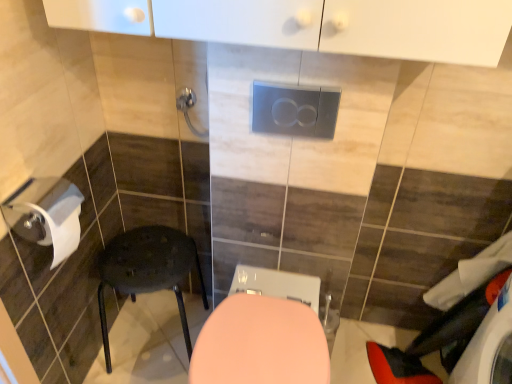
Question: Is matte black stool at lower left surrounded by metallic silver towel bar at upper center?

Choices:
 (A) yes
 (B) no

Answer: (B)

Question: From the image's perspective, is metallic silver towel bar at upper center beneath matte black stool at lower left?

Choices:
 (A) no
 (B) yes

Answer: (A)

Question: Considering the relative sizes of metallic silver towel bar at upper center and matte black stool at lower left in the image provided, is metallic silver towel bar at upper center shorter than matte black stool at lower left?

Choices:
 (A) no
 (B) yes

Answer: (B)

Question: Does metallic silver towel bar at upper center turn towards matte black stool at lower left?

Choices:
 (A) yes
 (B) no

Answer: (B)

Question: Can you confirm if metallic silver towel bar at upper center is positioned to the right of matte black stool at lower left?

Choices:
 (A) no
 (B) yes

Answer: (B)

Question: From the image's perspective, is pink glossy toilet at center above or below white fabric laundry at lower right?

Choices:
 (A) above
 (B) below

Answer: (B)

Question: Based on their sizes in the image, would you say pink glossy toilet at center is bigger or smaller than white fabric laundry at lower right?

Choices:
 (A) big
 (B) small

Answer: (A)

Question: Is pink glossy toilet at center inside or outside of white fabric laundry at lower right?

Choices:
 (A) inside
 (B) outside

Answer: (B)

Question: Is point (210, 370) closer or farther from the camera than point (509, 251)?

Choices:
 (A) farther
 (B) closer

Answer: (B)

Question: From a real-world perspective, is satin silver flush plate at center physically located above or below pink glossy toilet at center?

Choices:
 (A) above
 (B) below

Answer: (A)

Question: Considering their positions, is satin silver flush plate at center located in front of or behind pink glossy toilet at center?

Choices:
 (A) front
 (B) behind

Answer: (B)

Question: Based on their sizes in the image, would you say satin silver flush plate at center is bigger or smaller than pink glossy toilet at center?

Choices:
 (A) big
 (B) small

Answer: (B)

Question: From the image's perspective, is satin silver flush plate at center above or below pink glossy toilet at center?

Choices:
 (A) below
 (B) above

Answer: (B)

Question: From a real-world perspective, is satin silver flush plate at center positioned above or below white fabric laundry at lower right?

Choices:
 (A) below
 (B) above

Answer: (B)

Question: Would you say satin silver flush plate at center is to the left or to the right of white fabric laundry at lower right in the picture?

Choices:
 (A) left
 (B) right

Answer: (A)